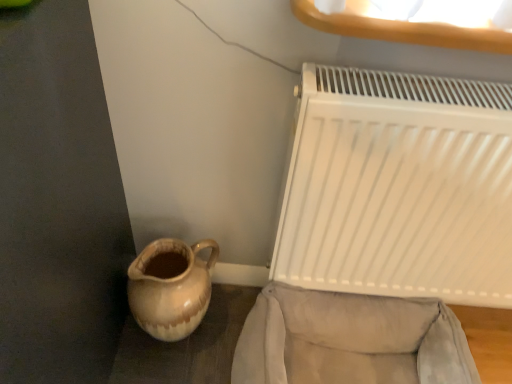
Identify the location of free location in front of brown glazed jug at lower left. (166, 369).